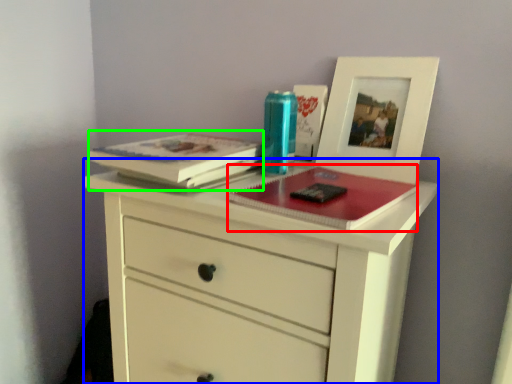
Question: Estimate the real-world distances between objects in this image. Which object is closer to magazine (highlighted by a red box), chest of drawers (highlighted by a blue box) or paperback book (highlighted by a green box)?

Choices:
 (A) chest of drawers
 (B) paperback book

Answer: (A)